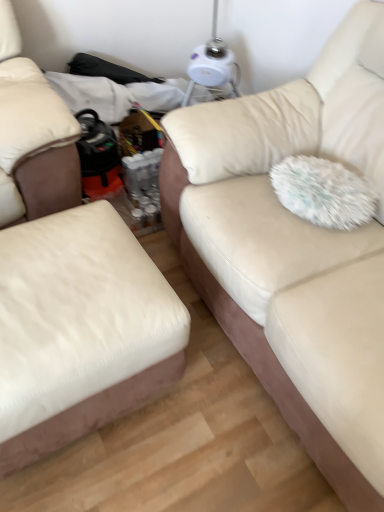
Question: From the image's perspective, is white plastic table lamp at upper center below white leather ottoman at left, acting as the first studio couch starting from the left?

Choices:
 (A) no
 (B) yes

Answer: (A)

Question: Is white plastic table lamp at upper center not inside white leather ottoman at left, marked as the second studio couch in a right-to-left arrangement?

Choices:
 (A) no
 (B) yes

Answer: (B)

Question: Does white plastic table lamp at upper center have a greater height compared to white leather ottoman at left, acting as the first studio couch starting from the left?

Choices:
 (A) no
 (B) yes

Answer: (B)

Question: Can you confirm if white plastic table lamp at upper center is positioned to the right of white leather ottoman at left, marked as the second studio couch in a right-to-left arrangement?

Choices:
 (A) yes
 (B) no

Answer: (A)

Question: Would you say white leather ottoman at left, marked as the second studio couch in a right-to-left arrangement, is part of white plastic table lamp at upper center's contents?

Choices:
 (A) no
 (B) yes

Answer: (A)

Question: Would you say white leather ottoman at left, acting as the first studio couch starting from the left, is to the left or to the right of white fluffy pillow at right in the picture?

Choices:
 (A) left
 (B) right

Answer: (A)

Question: Looking at their shapes, would you say white leather ottoman at left, acting as the first studio couch starting from the left, is wider or thinner than white fluffy pillow at right?

Choices:
 (A) wide
 (B) thin

Answer: (A)

Question: Is white leather ottoman at left, acting as the first studio couch starting from the left, inside the boundaries of white fluffy pillow at right, or outside?

Choices:
 (A) inside
 (B) outside

Answer: (B)

Question: Considering their positions, is white leather ottoman at left, acting as the first studio couch starting from the left, located in front of or behind white fluffy pillow at right?

Choices:
 (A) front
 (B) behind

Answer: (A)

Question: Is white leather ottoman at left, marked as the second studio couch in a right-to-left arrangement, in front of or behind beige fabric couch at center, marked as the second studio couch in a left-to-right arrangement, in the image?

Choices:
 (A) front
 (B) behind

Answer: (B)

Question: Is white leather ottoman at left, marked as the second studio couch in a right-to-left arrangement, inside the boundaries of beige fabric couch at center, placed as the 1th studio couch when sorted from right to left, or outside?

Choices:
 (A) outside
 (B) inside

Answer: (A)

Question: Is white leather ottoman at left, acting as the first studio couch starting from the left, to the left or to the right of beige fabric couch at center, placed as the 1th studio couch when sorted from right to left, in the image?

Choices:
 (A) left
 (B) right

Answer: (A)

Question: Is white leather ottoman at left, acting as the first studio couch starting from the left, wider or thinner than beige fabric couch at center, placed as the 1th studio couch when sorted from right to left?

Choices:
 (A) wide
 (B) thin

Answer: (B)

Question: Is white fluffy pillow at right inside the boundaries of white plastic table lamp at upper center, or outside?

Choices:
 (A) inside
 (B) outside

Answer: (B)

Question: Relative to white plastic table lamp at upper center, is white fluffy pillow at right in front or behind?

Choices:
 (A) behind
 (B) front

Answer: (B)